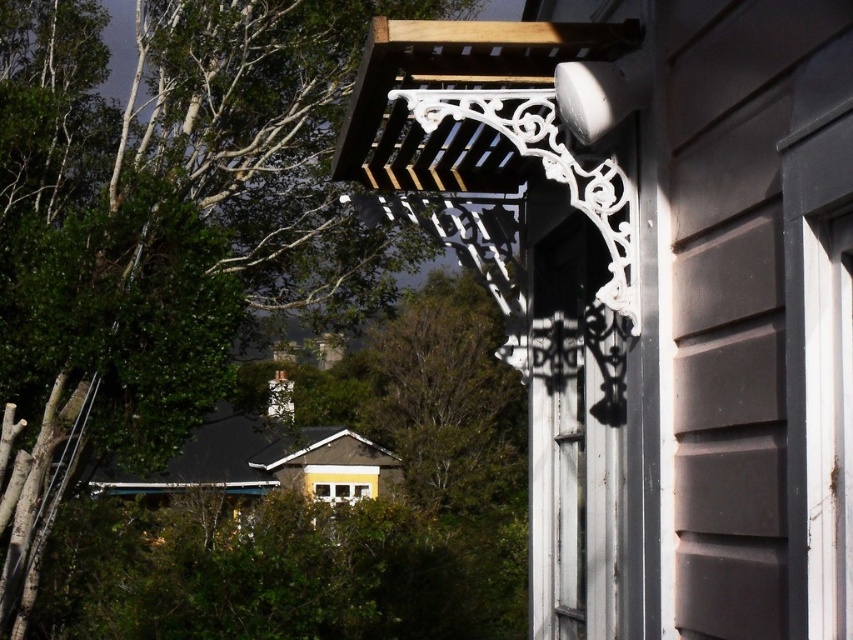
Is white wrought iron pergola at upper center closer to camera compared to green leafy tree at upper left?

Yes.

This screenshot has height=640, width=853. Describe the element at coordinates (650, 289) in the screenshot. I see `white wrought iron pergola at upper center` at that location.

Is point (808, 184) positioned after point (152, 230)?

That is False.

Where is `white wrought iron pergola at upper center`? The image size is (853, 640). white wrought iron pergola at upper center is located at coordinates (650, 289).

Does green leafy tree at upper left have a larger size compared to green leafy tree at center?

No.

Image resolution: width=853 pixels, height=640 pixels. What do you see at coordinates (161, 225) in the screenshot? I see `green leafy tree at upper left` at bounding box center [161, 225].

Between point (225, 264) and point (404, 452), which one is positioned behind?

Point (404, 452)

Identify the location of green leafy tree at upper left. (161, 225).

Can you confirm if white wrought iron pergola at upper center is thinner than green leafy tree at center?

Yes.

Can you confirm if white wrought iron pergola at upper center is taller than green leafy tree at center?

In fact, white wrought iron pergola at upper center may be shorter than green leafy tree at center.

Which is behind, point (675, 401) or point (509, 380)?

The point (509, 380) is more distant.

Locate an element on the screen. This screenshot has width=853, height=640. white wrought iron pergola at upper center is located at coordinates (650, 289).